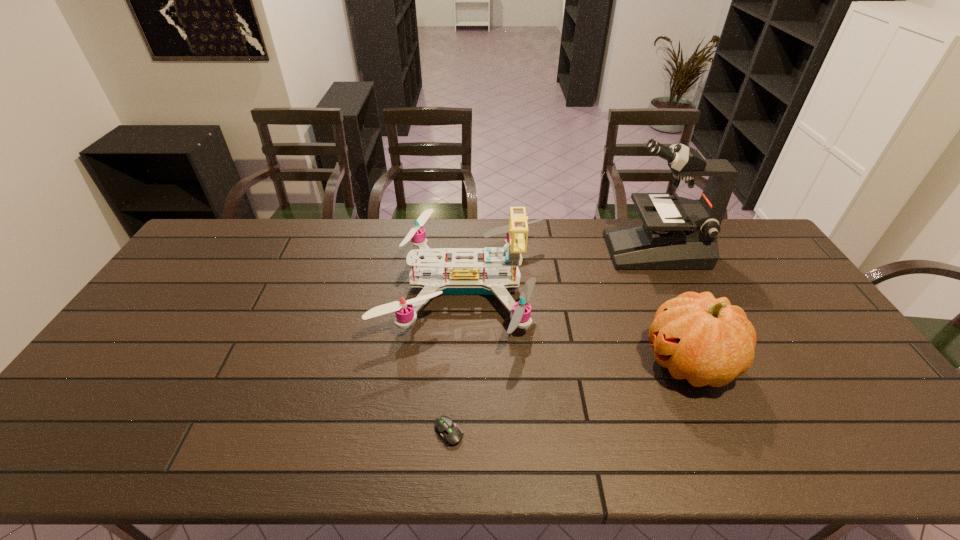
What are the coordinates of `vacant area situated on the carved face of the pumpkin` in the screenshot? It's located at (509, 363).

Locate an element on the screen. Image resolution: width=960 pixels, height=540 pixels. free space located 0.330m on the carved face of the pumpkin is located at coordinates (520, 363).

This screenshot has height=540, width=960. Identify the location of vacant region located 0.050m on the right of the shortest object. (486, 432).

Find the location of a particular element. Image resolution: width=960 pixels, height=540 pixels. microscope situated at the far edge is located at coordinates (682, 234).

Find the location of `drone present at the far edge`. drone present at the far edge is located at coordinates (464, 276).

This screenshot has height=540, width=960. What are the coordinates of `object that is at the near edge` in the screenshot? It's located at (449, 432).

Identify the location of free spot at the far edge of the desktop. (349, 258).

Where is `blank area at the near edge`? blank area at the near edge is located at coordinates (716, 442).

Find the location of a particular element. The width and height of the screenshot is (960, 540). vacant space at the left edge of the desktop is located at coordinates click(158, 302).

Where is `free space at the right edge of the desktop`? The width and height of the screenshot is (960, 540). free space at the right edge of the desktop is located at coordinates (x=830, y=383).